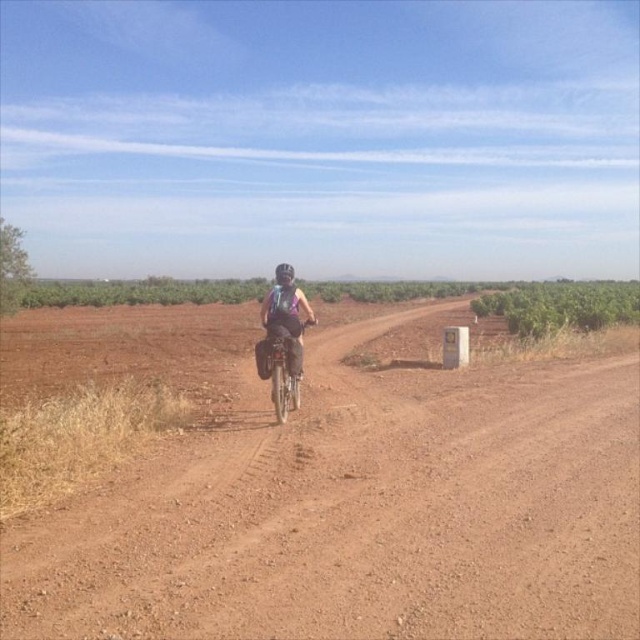
Is brown gravel road at center wider than matte purple backpack at center?

Indeed, brown gravel road at center has a greater width compared to matte purple backpack at center.

Does point (413, 417) lie behind point (282, 336)?

Yes, it is behind point (282, 336).

At what (x,y) coordinates should I click in order to perform the action: click on brown gravel road at center. Please return your answer as a coordinate pair (x, y). This screenshot has height=640, width=640. Looking at the image, I should click on (358, 512).

Between matte purple backpack at center and shiny metallic bicycle at center, which one is positioned lower?

shiny metallic bicycle at center

Where is `matte purple backpack at center`? The height and width of the screenshot is (640, 640). matte purple backpack at center is located at coordinates (284, 321).

Is point (278, 323) behind point (284, 339)?

Yes, point (278, 323) is farther from viewer.

The height and width of the screenshot is (640, 640). Find the location of `matte purple backpack at center`. matte purple backpack at center is located at coordinates (284, 321).

Describe the element at coordinates (358, 512) in the screenshot. I see `brown gravel road at center` at that location.

Based on the photo, which is more to the left, brown gravel road at center or shiny metallic bicycle at center?

shiny metallic bicycle at center is more to the left.

Which is in front, point (211, 500) or point (280, 410)?

Point (211, 500) is more forward.

I want to click on brown gravel road at center, so click(x=358, y=512).